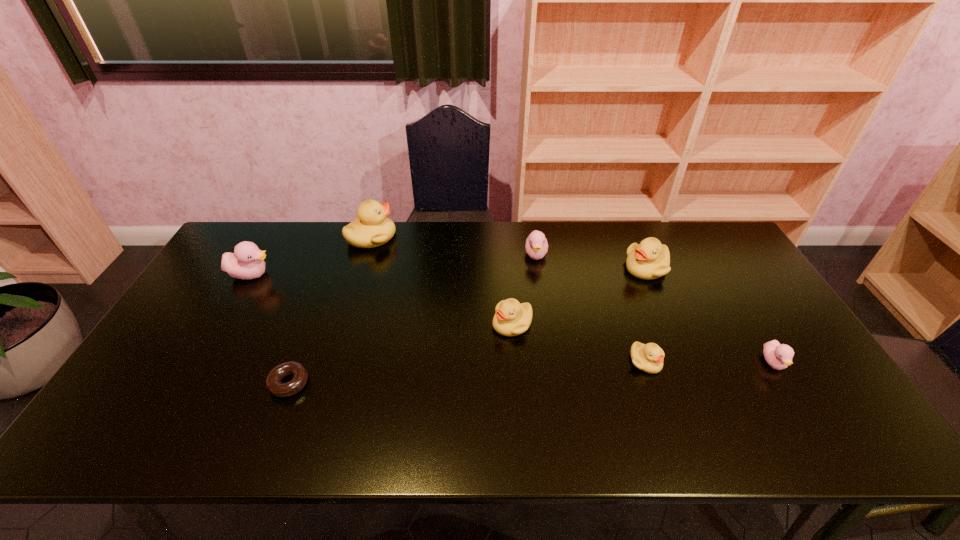
The height and width of the screenshot is (540, 960). What are the coordinates of `the second duckling from left to right` in the screenshot? It's located at (372, 228).

Locate an element on the screen. the farthest yellow duckling is located at coordinates (372, 228).

Identify the location of the leftmost pink duckling. (247, 262).

Where is `the biggest pink duckling`? The image size is (960, 540). the biggest pink duckling is located at coordinates (247, 262).

I want to click on the second farthest yellow duckling, so click(x=649, y=259).

Image resolution: width=960 pixels, height=540 pixels. Identify the location of the second pink duckling from left to right. (536, 246).

In order to click on the fourth object from right to left in this screenshot , I will do `click(536, 246)`.

In order to click on the fourth nearest object in this screenshot , I will do `click(511, 318)`.

In order to click on the second nearest yellow duckling in this screenshot , I will do coord(511,318).

This screenshot has height=540, width=960. I want to click on the smallest pink duckling, so click(x=779, y=356).